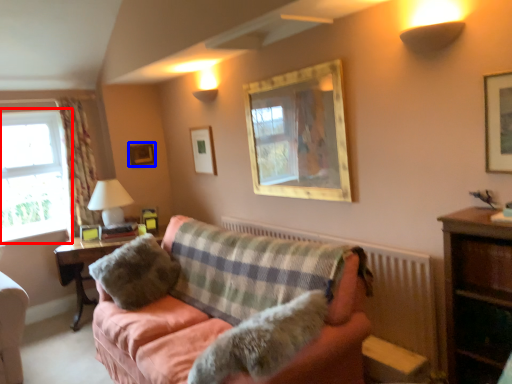
Question: Which object appears closest to the camera in this image, window (highlighted by a red box) or picture frame (highlighted by a blue box)?

Choices:
 (A) window
 (B) picture frame

Answer: (A)